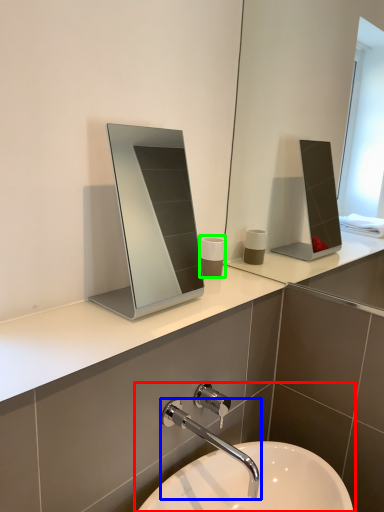
Question: Considering the real-world distances, which object is farthest from sink (highlighted by a red box)? tap (highlighted by a blue box) or toiletry (highlighted by a green box)?

Choices:
 (A) tap
 (B) toiletry

Answer: (B)